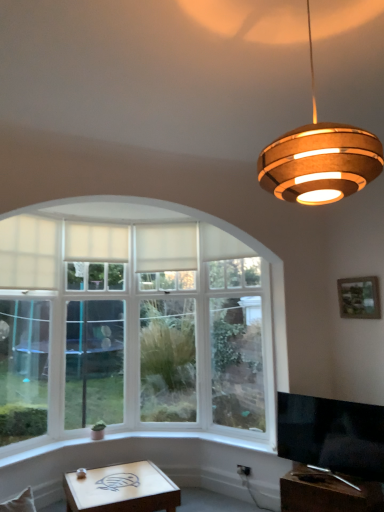
In order to click on free space above matte white wooden table at lower center, positioned as the 1th table in left-to-right order (from a real-world perspective) in this screenshot , I will do `click(115, 488)`.